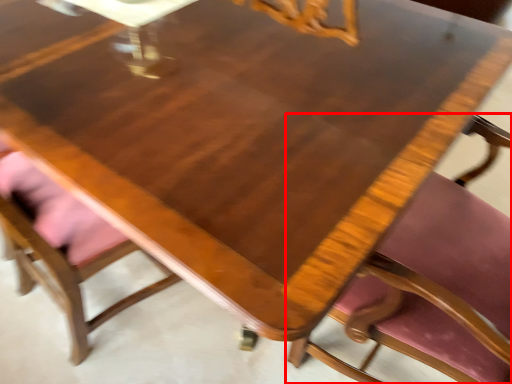
Question: From the image's perspective, where is chair (annotated by the red box) located in relation to chair in the image?

Choices:
 (A) above
 (B) below

Answer: (B)